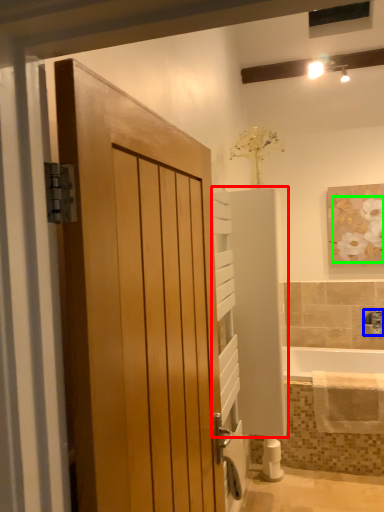
Question: Which object is the closest to the elevator (highlighted by a red box)? Choose among these: tap (highlighted by a blue box) or flower (highlighted by a green box).

Choices:
 (A) tap
 (B) flower

Answer: (B)